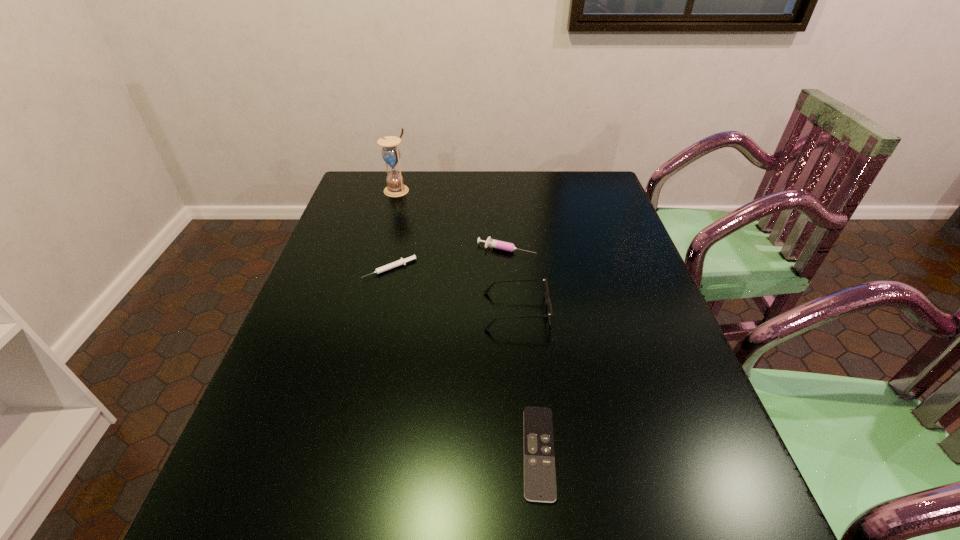
Locate an element on the screen. object located at the far left corner is located at coordinates (391, 154).

Image resolution: width=960 pixels, height=540 pixels. Identify the location of vacant area at the far edge of the desktop. (450, 198).

This screenshot has width=960, height=540. In order to click on vacant region at the left edge of the desktop in this screenshot , I will do `click(270, 483)`.

In the image, there is a desktop. Identify the location of vacant region at the right edge. Image resolution: width=960 pixels, height=540 pixels. click(x=578, y=238).

What are the coordinates of `free region at the far left corner of the desktop` in the screenshot? It's located at (376, 180).

Locate an element on the screen. This screenshot has width=960, height=540. free region at the far right corner of the desktop is located at coordinates (571, 205).

Where is `vacant space that's between the remote control and the second tallest object`? This screenshot has height=540, width=960. vacant space that's between the remote control and the second tallest object is located at coordinates (527, 382).

What are the coordinates of `vacant area that lies between the taller syringe and the shortest object` in the screenshot? It's located at (522, 351).

Identify the location of free space between the shorter syringe and the farthest object. This screenshot has height=540, width=960. (394, 230).

Identify the location of blank region between the nearest object and the fourth tallest object. (465, 361).